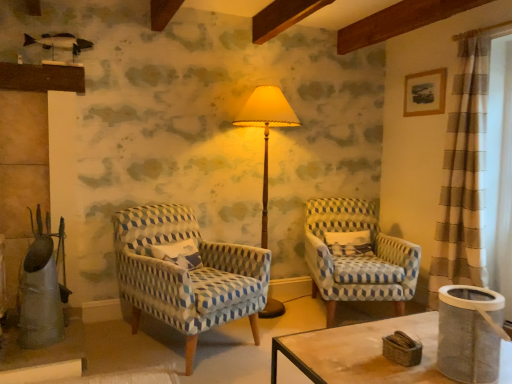
Question: From the image's perspective, is blue patterned fabric chair at center, which is the second chair in right-to-left order, located above or below white mesh screen at right?

Choices:
 (A) above
 (B) below

Answer: (B)

Question: Looking at their shapes, would you say blue patterned fabric chair at center, marked as the 1th chair in a left-to-right arrangement, is wider or thinner than white mesh screen at right?

Choices:
 (A) wide
 (B) thin

Answer: (A)

Question: Which object is positioned closest to the matte yellow fabric lampshade at center?

Choices:
 (A) white mesh screen at right
 (B) white textured pillow at center
 (C) blue patterned fabric chair at center, the 1th chair in the right-to-left sequence
 (D) blue patterned fabric chair at center, marked as the 1th chair in a left-to-right arrangement

Answer: (C)

Question: Which is farther from the blue patterned fabric chair at center, the 1th chair in the right-to-left sequence?

Choices:
 (A) white mesh screen at right
 (B) matte yellow fabric lampshade at center
 (C) blue patterned fabric chair at center, marked as the 1th chair in a left-to-right arrangement
 (D) white textured pillow at center

Answer: (A)